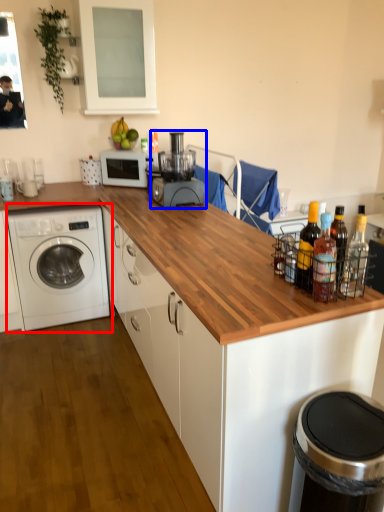
Question: Which object is further to the camera taking this photo, washing machine (highlighted by a red box) or blender (highlighted by a blue box)?

Choices:
 (A) washing machine
 (B) blender

Answer: (A)